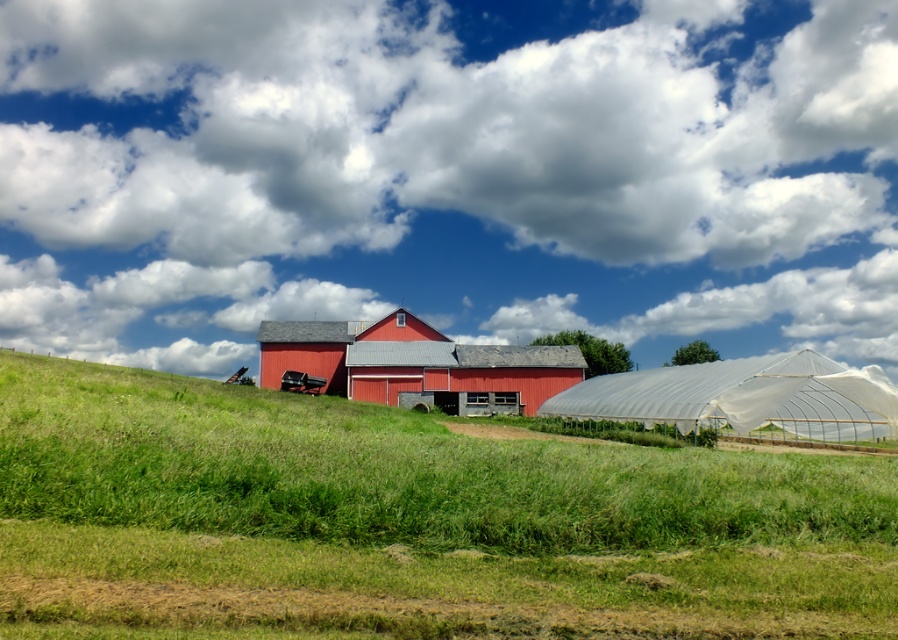
Based on the photo, between white fluffy cloud at upper center and green grassy field at lower center, which one appears on the left side from the viewer's perspective?

white fluffy cloud at upper center is more to the left.

Which is in front, point (665, 33) or point (377, 529)?

Point (377, 529)

Identify the location of white fluffy cloud at upper center. (449, 173).

You are a GUI agent. You are given a task and a screenshot of the screen. Output one action in this format:
    pyautogui.click(x=<x>, y=<y>)
    Task: Click on the white fluffy cloud at upper center
    The width and height of the screenshot is (898, 640).
    Given the screenshot: What is the action you would take?
    pyautogui.click(x=449, y=173)

In the scene shown: Is white fluffy cloud at upper center closer to the viewer compared to matte red barn at center?

That is False.

The height and width of the screenshot is (640, 898). I want to click on white fluffy cloud at upper center, so click(x=449, y=173).

The width and height of the screenshot is (898, 640). Identify the location of green grassy field at lower center. (408, 524).

Who is more forward, (x=436, y=502) or (x=420, y=352)?

Point (x=436, y=502) is more forward.

Where is `green grassy field at lower center`? The height and width of the screenshot is (640, 898). green grassy field at lower center is located at coordinates (408, 524).